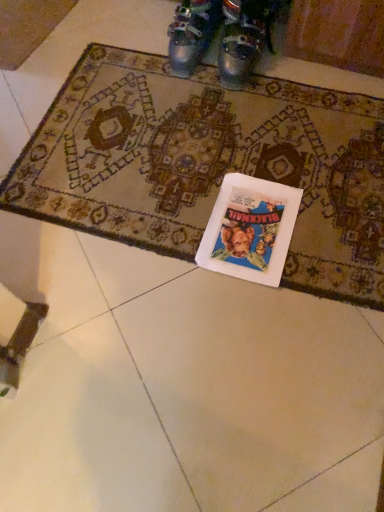
At what (x,y) coordinates should I click in order to perform the action: click on free space to the left of metallic silver boots at upper center, the second footwear when ordered from right to left. Please return your answer as a coordinate pair (x, y). Looking at the image, I should click on (128, 57).